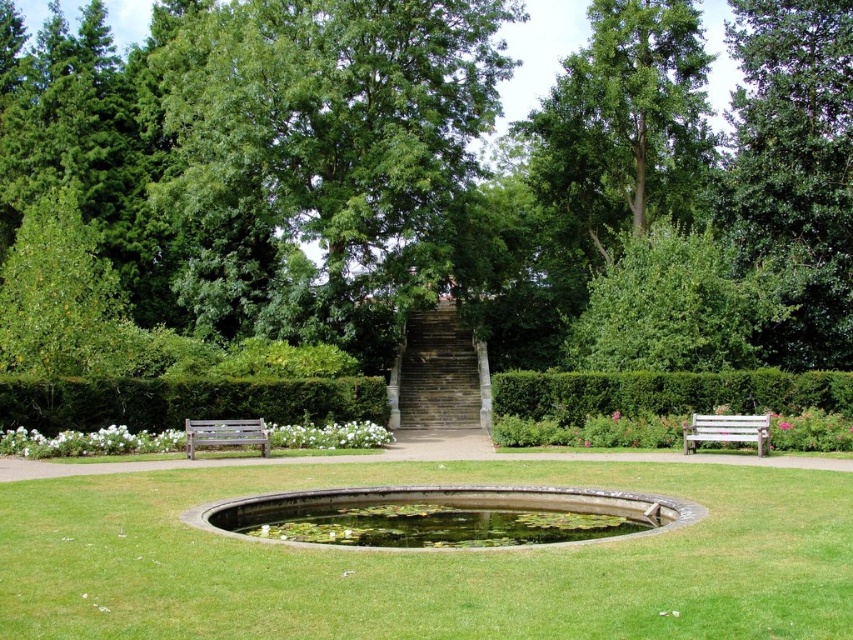
You are walking along the pathway in the garden and notice two green leafy trees. One is labeled as the green leafy tree at center and the other as the green leafy tree at upper right. Which tree would appear closer to you as you stand on the pathway?

The green leafy tree at center appears closer because it is in front of the green leafy tree at upper right, making it nearer to your position on the pathway.

You are standing at the entrance of the garden and want to take a photo of both the green leafy tree at center and the green leafy tree at upper right. Which tree should you position yourself closer to in order to include both in your camera frame?

You should position yourself closer to the green leafy tree at upper right because the green leafy tree at center is above it, so adjusting your position to be nearer to the upper right tree will help frame both trees within the camera view.

You are standing at the edge of the pond in the garden scene. You see two points marked as point 1 and point 2. Point 1 is at coordinate [303,61] and point 2 is at coordinate [187,429]. If you want to take a photo that includes both points, which point should you focus on first to ensure both are in clear view?

To ensure both points are in clear view, focus on point 1 at coordinate [303,61] first because it is closer to the camera than point 2 at coordinate [187,429]. This way, the camera can adjust the focus to include both the nearer and farther points.